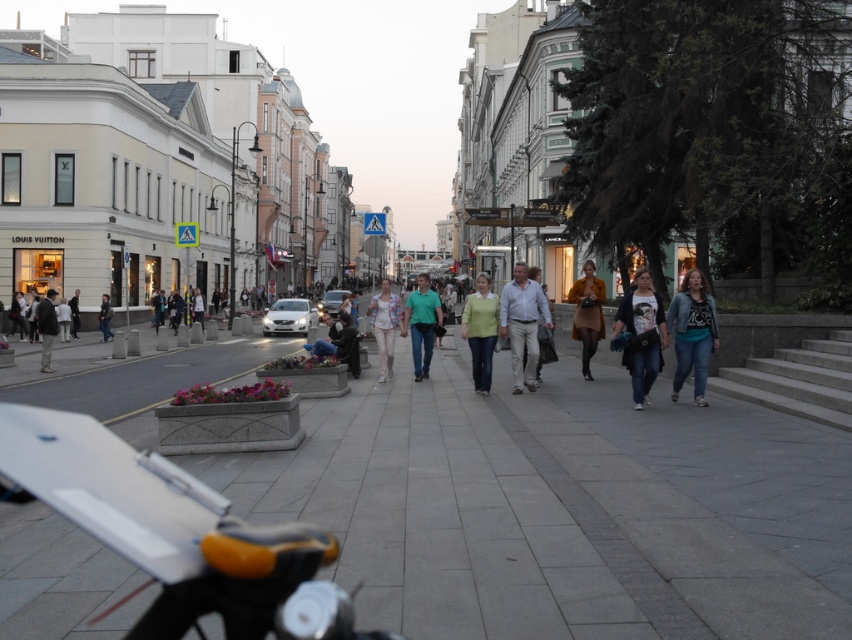
Who is lower down, gray concrete pavement at center or dark brown leather jacket at center?

gray concrete pavement at center is below.

Is gray concrete pavement at center to the left of dark brown leather jacket at center from the viewer's perspective?

No, gray concrete pavement at center is not to the left of dark brown leather jacket at center.

This screenshot has width=852, height=640. Find the location of `gray concrete pavement at center`. gray concrete pavement at center is located at coordinates (563, 508).

In order to click on gray concrete pavement at center in this screenshot , I will do `click(563, 508)`.

Describe the element at coordinates (384, 324) in the screenshot. This screenshot has width=852, height=640. I see `light pink fabric pants at center` at that location.

Is point (381, 374) in front of point (39, 324)?

Yes, point (381, 374) is closer to viewer.

Locate an element on the screen. light pink fabric pants at center is located at coordinates (384, 324).

Does point (49, 356) come farther from viewer compared to point (108, 308)?

No, it is not.

Who is positioned more to the left, dark gray suit at left or dark brown leather jacket at center?

Positioned to the left is dark brown leather jacket at center.

Identify the location of dark gray suit at left. (45, 326).